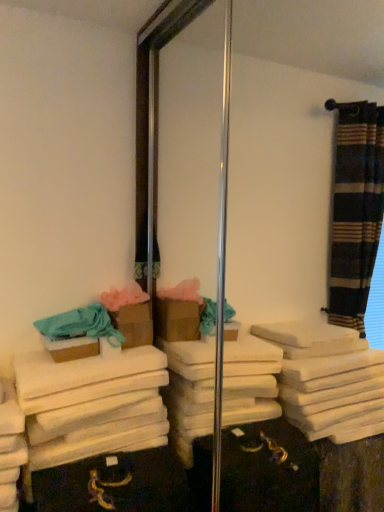
This screenshot has height=512, width=384. I want to click on white soft towel at lower left, the 2th bath towel from the top, so click(x=91, y=404).

The image size is (384, 512). In order to click on teal cotton bath towel at left, marked as the second bath towel in a bottom-to-top arrangement in this screenshot , I will do tap(81, 325).

From a real-world perspective, is white soft towel at lower left, the 2th bath towel from the top, above or below teal cotton bath towel at left, which is the first bath towel from top to bottom?

white soft towel at lower left, the 2th bath towel from the top, is below teal cotton bath towel at left, which is the first bath towel from top to bottom.

Between white soft towel at lower left, the 2th bath towel from the top, and teal cotton bath towel at left, which is the first bath towel from top to bottom, which one has less height?

white soft towel at lower left, the 2th bath towel from the top, is shorter.

Could you tell me if white soft towel at lower left, the 2th bath towel from the top, is turned towards teal cotton bath towel at left, which is the first bath towel from top to bottom?

No, white soft towel at lower left, the 2th bath towel from the top, is not turned towards teal cotton bath towel at left, which is the first bath towel from top to bottom.

Looking at this image, can you tell me how much white soft towel at lower left, marked as the first bath towel in a bottom-to-top arrangement, and teal cotton bath towel at left, marked as the second bath towel in a bottom-to-top arrangement, differ in facing direction?

The facing directions of white soft towel at lower left, marked as the first bath towel in a bottom-to-top arrangement, and teal cotton bath towel at left, marked as the second bath towel in a bottom-to-top arrangement, are 5.12 degrees apart.

From the image's perspective, is teal cotton bath towel at left, marked as the second bath towel in a bottom-to-top arrangement, on brown cardboard box at left, marked as the 1th box in a back-to-front arrangement?

No, from the image's perspective, teal cotton bath towel at left, marked as the second bath towel in a bottom-to-top arrangement, is not over brown cardboard box at left, marked as the 1th box in a back-to-front arrangement.

Which object is more forward, teal cotton bath towel at left, which is the first bath towel from top to bottom, or brown cardboard box at left, marked as the 1th box in a back-to-front arrangement?

teal cotton bath towel at left, which is the first bath towel from top to bottom.

Which is less distant, (82, 325) or (147, 323)?

The point (82, 325) is in front.

Looking at this image, in the image, is teal cotton bath towel at left, which is the first bath towel from top to bottom, on the left side or the right side of brown cardboard box at left, marked as the 1th box in a back-to-front arrangement?

teal cotton bath towel at left, which is the first bath towel from top to bottom, is to the left of brown cardboard box at left, marked as the 1th box in a back-to-front arrangement.

Is teal cotton bath towel at left, marked as the second bath towel in a bottom-to-top arrangement, aimed at brown cardboard box at center, positioned as the 2th box in back-to-front order?

Yes.

Could you measure the distance between teal cotton bath towel at left, marked as the second bath towel in a bottom-to-top arrangement, and brown cardboard box at center, positioned as the 2th box in back-to-front order?

teal cotton bath towel at left, marked as the second bath towel in a bottom-to-top arrangement, and brown cardboard box at center, positioned as the 2th box in back-to-front order, are 2.36 inches apart from each other.

Consider the image. From the image's perspective, which is below, teal cotton bath towel at left, marked as the second bath towel in a bottom-to-top arrangement, or brown cardboard box at center, positioned as the 2th box in back-to-front order?

brown cardboard box at center, positioned as the 2th box in back-to-front order, from the image's perspective.

From the picture: Between teal cotton bath towel at left, marked as the second bath towel in a bottom-to-top arrangement, and brown cardboard box at center, the 1th box from the front, which one appears on the left side from the viewer's perspective?

brown cardboard box at center, the 1th box from the front, is more to the left.

Who is taller, brown cardboard box at left, which is the 2th box in front-to-back order, or brown cardboard box at center, the 1th box from the front?

brown cardboard box at left, which is the 2th box in front-to-back order, is taller.

This screenshot has width=384, height=512. I want to click on box that appears below the brown cardboard box at left, which is the 2th box in front-to-back order (from a real-world perspective), so click(x=72, y=348).

In terms of width, does brown cardboard box at left, which is the 2th box in front-to-back order, look wider or thinner when compared to brown cardboard box at center, the 1th box from the front?

Clearly, brown cardboard box at left, which is the 2th box in front-to-back order, has more width compared to brown cardboard box at center, the 1th box from the front.

Which of these two, white soft towel at lower left, the 2th bath towel from the top, or brown cardboard box at left, which is the 2th box in front-to-back order, is wider?

With larger width is white soft towel at lower left, the 2th bath towel from the top.

Based on the photo, is white soft towel at lower left, marked as the first bath towel in a bottom-to-top arrangement, smaller than brown cardboard box at left, which is the 2th box in front-to-back order?

Incorrect, white soft towel at lower left, marked as the first bath towel in a bottom-to-top arrangement, is not smaller in size than brown cardboard box at left, which is the 2th box in front-to-back order.

From the image's perspective, is white soft towel at lower left, the 2th bath towel from the top, below brown cardboard box at left, marked as the 1th box in a back-to-front arrangement?

Indeed, from the image's perspective, white soft towel at lower left, the 2th bath towel from the top, is shown beneath brown cardboard box at left, marked as the 1th box in a back-to-front arrangement.

Is white soft towel at lower left, the 2th bath towel from the top, inside or outside of brown cardboard box at left, marked as the 1th box in a back-to-front arrangement?

white soft towel at lower left, the 2th bath towel from the top, is located beyond the bounds of brown cardboard box at left, marked as the 1th box in a back-to-front arrangement.

From a real-world perspective, between brown cardboard box at left, which is the 2th box in front-to-back order, and teal cotton bath towel at left, marked as the second bath towel in a bottom-to-top arrangement, who is vertically lower?

In real-world perspective, brown cardboard box at left, which is the 2th box in front-to-back order, is lower.

Is brown cardboard box at left, which is the 2th box in front-to-back order, next to teal cotton bath towel at left, marked as the second bath towel in a bottom-to-top arrangement?

No, brown cardboard box at left, which is the 2th box in front-to-back order, is not beside teal cotton bath towel at left, marked as the second bath towel in a bottom-to-top arrangement.

Is brown cardboard box at left, which is the 2th box in front-to-back order, turned away from teal cotton bath towel at left, which is the first bath towel from top to bottom?

No, brown cardboard box at left, which is the 2th box in front-to-back order, is not facing away from teal cotton bath towel at left, which is the first bath towel from top to bottom.

In the scene shown: Is brown cardboard box at left, marked as the 1th box in a back-to-front arrangement, bigger than teal cotton bath towel at left, marked as the second bath towel in a bottom-to-top arrangement?

No.

From a real-world perspective, is teal cotton bath towel at left, which is the first bath towel from top to bottom, beneath white soft towel at lower left, marked as the first bath towel in a bottom-to-top arrangement?

No.

Does teal cotton bath towel at left, marked as the second bath towel in a bottom-to-top arrangement, contain white soft towel at lower left, the 2th bath towel from the top?

Actually, white soft towel at lower left, the 2th bath towel from the top, is outside teal cotton bath towel at left, marked as the second bath towel in a bottom-to-top arrangement.

Is teal cotton bath towel at left, which is the first bath towel from top to bottom, wider or thinner than white soft towel at lower left, marked as the first bath towel in a bottom-to-top arrangement?

In the image, teal cotton bath towel at left, which is the first bath towel from top to bottom, appears to be more narrow than white soft towel at lower left, marked as the first bath towel in a bottom-to-top arrangement.

Could you tell me if teal cotton bath towel at left, which is the first bath towel from top to bottom, is facing white soft towel at lower left, the 2th bath towel from the top?

No.

At what (x,y) coordinates should I click in order to perform the action: click on bath towel in front of the teal cotton bath towel at left, which is the first bath towel from top to bottom. Please return your answer as a coordinate pair (x, y). This screenshot has height=512, width=384. Looking at the image, I should click on (91, 404).

From the teal cotton bath towel at left, marked as the second bath towel in a bottom-to-top arrangement, count 2nd boxs backward and point to it. Please provide its 2D coordinates.

[(134, 324)]

Estimate the real-world distances between objects in this image. Which object is further from brown cardboard box at center, positioned as the 2th box in back-to-front order, teal cotton bath towel at left, marked as the second bath towel in a bottom-to-top arrangement, or white soft towel at lower left, marked as the first bath towel in a bottom-to-top arrangement?

white soft towel at lower left, marked as the first bath towel in a bottom-to-top arrangement, lies further to brown cardboard box at center, positioned as the 2th box in back-to-front order, than the other object.

When comparing their distances from white soft towel at lower left, marked as the first bath towel in a bottom-to-top arrangement, does brown cardboard box at center, positioned as the 2th box in back-to-front order, or teal cotton bath towel at left, marked as the second bath towel in a bottom-to-top arrangement, seem closer?

Among the two, brown cardboard box at center, positioned as the 2th box in back-to-front order, is located nearer to white soft towel at lower left, marked as the first bath towel in a bottom-to-top arrangement.

When comparing their distances from white soft towel at lower left, marked as the first bath towel in a bottom-to-top arrangement, does brown cardboard box at left, marked as the 1th box in a back-to-front arrangement, or brown cardboard box at center, positioned as the 2th box in back-to-front order, seem further?

brown cardboard box at left, marked as the 1th box in a back-to-front arrangement, is further to white soft towel at lower left, marked as the first bath towel in a bottom-to-top arrangement.

Estimate the real-world distances between objects in this image. Which object is further from brown cardboard box at center, positioned as the 2th box in back-to-front order, teal cotton bath towel at left, which is the first bath towel from top to bottom, or brown cardboard box at left, marked as the 1th box in a back-to-front arrangement?

Among the two, brown cardboard box at left, marked as the 1th box in a back-to-front arrangement, is located further to brown cardboard box at center, positioned as the 2th box in back-to-front order.

Looking at the image, which one is located further to brown cardboard box at left, marked as the 1th box in a back-to-front arrangement, brown cardboard box at center, the 1th box from the front, or white soft towel at lower left, marked as the first bath towel in a bottom-to-top arrangement?

white soft towel at lower left, marked as the first bath towel in a bottom-to-top arrangement, is positioned further to the anchor brown cardboard box at left, marked as the 1th box in a back-to-front arrangement.

From the picture: Based on their spatial positions, is brown cardboard box at left, marked as the 1th box in a back-to-front arrangement, or brown cardboard box at center, positioned as the 2th box in back-to-front order, closer to teal cotton bath towel at left, which is the first bath towel from top to bottom?

brown cardboard box at center, positioned as the 2th box in back-to-front order, lies closer to teal cotton bath towel at left, which is the first bath towel from top to bottom, than the other object.

Based on their spatial positions, is teal cotton bath towel at left, marked as the second bath towel in a bottom-to-top arrangement, or brown cardboard box at center, positioned as the 2th box in back-to-front order, closer to white soft towel at lower left, marked as the first bath towel in a bottom-to-top arrangement?

brown cardboard box at center, positioned as the 2th box in back-to-front order, is positioned closer to the anchor white soft towel at lower left, marked as the first bath towel in a bottom-to-top arrangement.

Estimate the real-world distances between objects in this image. Which object is further from brown cardboard box at center, positioned as the 2th box in back-to-front order, brown cardboard box at left, marked as the 1th box in a back-to-front arrangement, or teal cotton bath towel at left, which is the first bath towel from top to bottom?

brown cardboard box at left, marked as the 1th box in a back-to-front arrangement.

Locate an element on the screen. This screenshot has width=384, height=512. box between teal cotton bath towel at left, which is the first bath towel from top to bottom, and brown cardboard box at left, marked as the 1th box in a back-to-front arrangement, from front to back is located at coordinates (72, 348).

Where is `box between teal cotton bath towel at left, marked as the second bath towel in a bottom-to-top arrangement, and white soft towel at lower left, the 2th bath towel from the top, from top to bottom`? Image resolution: width=384 pixels, height=512 pixels. box between teal cotton bath towel at left, marked as the second bath towel in a bottom-to-top arrangement, and white soft towel at lower left, the 2th bath towel from the top, from top to bottom is located at coordinates (72, 348).

Where is `box that lies between brown cardboard box at left, marked as the 1th box in a back-to-front arrangement, and white soft towel at lower left, the 2th bath towel from the top, from top to bottom`? box that lies between brown cardboard box at left, marked as the 1th box in a back-to-front arrangement, and white soft towel at lower left, the 2th bath towel from the top, from top to bottom is located at coordinates (72, 348).

Image resolution: width=384 pixels, height=512 pixels. What are the coordinates of `bath towel between brown cardboard box at left, which is the 2th box in front-to-back order, and white soft towel at lower left, the 2th bath towel from the top, in the vertical direction` in the screenshot? It's located at (x=81, y=325).